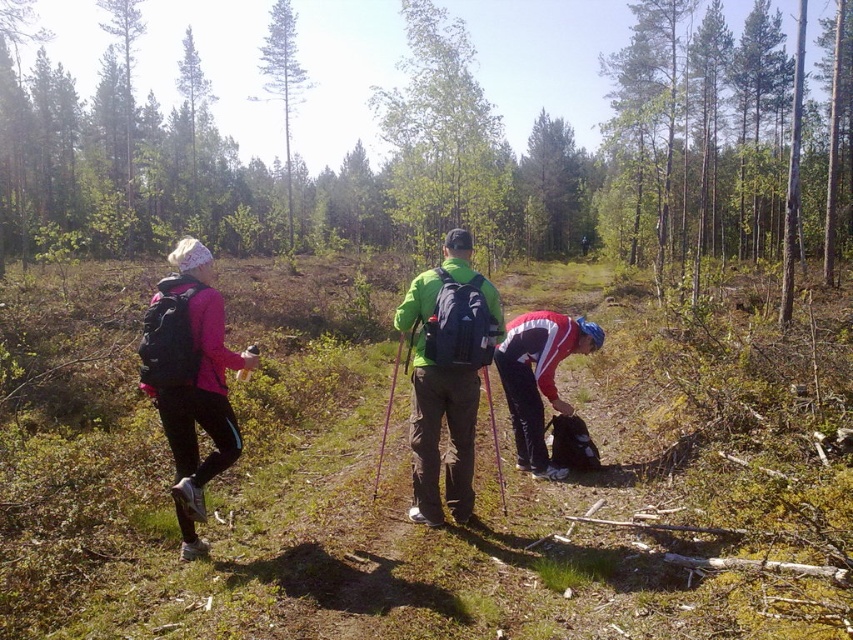
You are a hiker trying to locate a hidden trail marker. You see the green matte jacket at center and the green smooth tree at upper center. Which object is shorter?

The green matte jacket at center is shorter than the green smooth tree at upper center.

You are a hiker trying to navigate through the forest. You notice the red and white jacket at lower center and the green smooth tree at upper center. Which object takes up more space in the image?

The green smooth tree at upper center takes up more space in the image than the red and white jacket at lower center.

Consider the image. You are a hiker trying to locate the red and white jacket at lower center in the forest. From your current position, which direction should you look to find it relative to the green smooth tree at upper center?

The red and white jacket at lower center is positioned under the green smooth tree at upper center, so you should look downward or below the green smooth tree at upper center to find it.